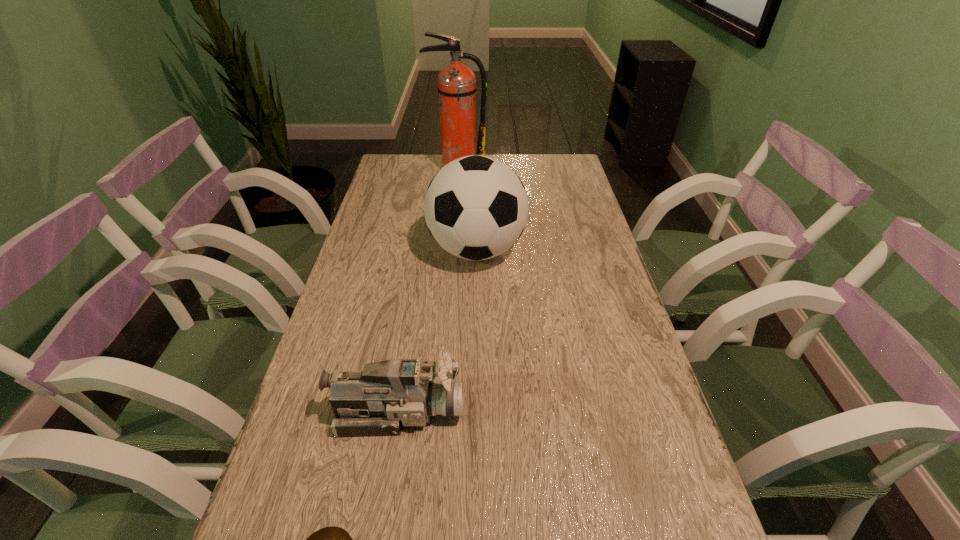
Where is `object that is at the left edge`? Image resolution: width=960 pixels, height=540 pixels. object that is at the left edge is located at coordinates (384, 396).

Where is `vacant space at the far edge`? vacant space at the far edge is located at coordinates (511, 156).

In the image, there is a desktop. At what (x,y) coordinates should I click in order to perform the action: click on vacant space at the left edge. Please return your answer as a coordinate pair (x, y). The image size is (960, 540). Looking at the image, I should click on (384, 286).

Image resolution: width=960 pixels, height=540 pixels. In the image, there is a desktop. Identify the location of blank space at the right edge. (588, 372).

Locate an element on the screen. Image resolution: width=960 pixels, height=540 pixels. vacant region at the far left corner of the desktop is located at coordinates (416, 156).

Find the location of `vacant area at the far right corner of the desktop`. vacant area at the far right corner of the desktop is located at coordinates (535, 156).

Identify the location of free area in between the second tallest object and the third farthest object. (438, 330).

Where is `vacant region between the second shortest object and the second farthest object`? This screenshot has width=960, height=540. vacant region between the second shortest object and the second farthest object is located at coordinates (438, 330).

Where is `object that stands as the closest to the tallest object`? Image resolution: width=960 pixels, height=540 pixels. object that stands as the closest to the tallest object is located at coordinates (476, 207).

You are a GUI agent. You are given a task and a screenshot of the screen. Output one action in this format:
    pyautogui.click(x=<x>, y=<y>)
    Task: Click on the second closest object to the nearest object
    The width and height of the screenshot is (960, 540).
    Given the screenshot: What is the action you would take?
    pyautogui.click(x=476, y=207)